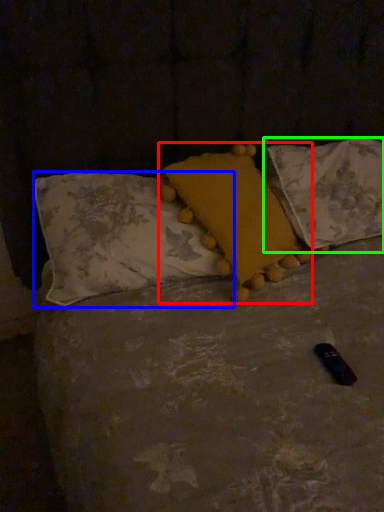
Question: Which is nearer to the pillow (highlighted by a red box)? pillow (highlighted by a blue box) or pillow (highlighted by a green box).

Choices:
 (A) pillow
 (B) pillow

Answer: (A)